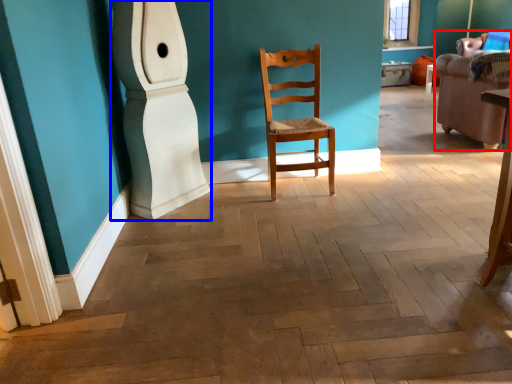
Question: Which point is further to the camera, armchair (highlighted by a red box) or pillar (highlighted by a blue box)?

Choices:
 (A) armchair
 (B) pillar

Answer: (A)